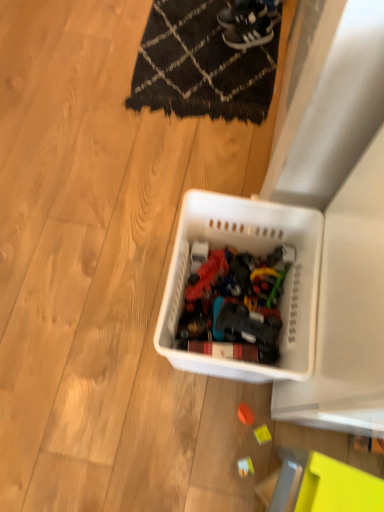
Identify the location of vacant region to the right of yellow plastic toy at lower right, arranged as the 2th toy when ordered from the bottom. (306, 434).